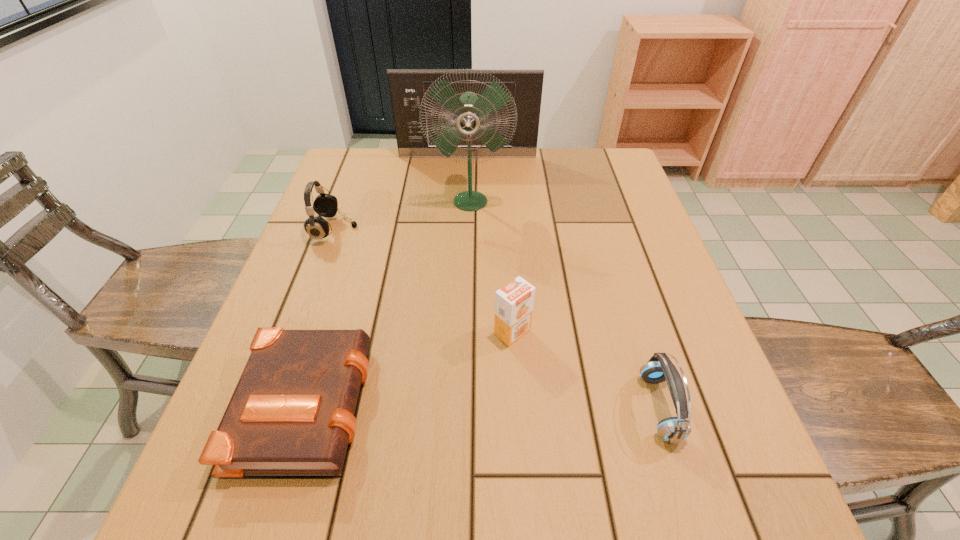
Where is `vacant space located 0.160m on the front panel of the microwave oven`? This screenshot has width=960, height=540. vacant space located 0.160m on the front panel of the microwave oven is located at coordinates (467, 186).

Find the location of a particular element. The width and height of the screenshot is (960, 540). blank space located 0.390m with the microphone on the side of the taller headset is located at coordinates [508, 230].

Where is `free space located on the back of the orange juice`? This screenshot has height=540, width=960. free space located on the back of the orange juice is located at coordinates (510, 301).

Locate an element on the screen. This screenshot has height=540, width=960. vacant space located on the ear cups of the right headset is located at coordinates (594, 408).

Identify the location of free location located 0.230m on the ear cups of the right headset. (516, 408).

Find the location of a particular element. The width and height of the screenshot is (960, 540). free space located 0.060m on the ear cups of the right headset is located at coordinates (611, 408).

Where is `vacant space located on the spine side of the shortest object`? vacant space located on the spine side of the shortest object is located at coordinates (543, 400).

The image size is (960, 540). Identify the location of fan located at the far edge. (469, 109).

Locate an element on the screen. microwave oven located at the far edge is located at coordinates (407, 87).

Find the location of `object that is at the near edge`. object that is at the near edge is located at coordinates (292, 412).